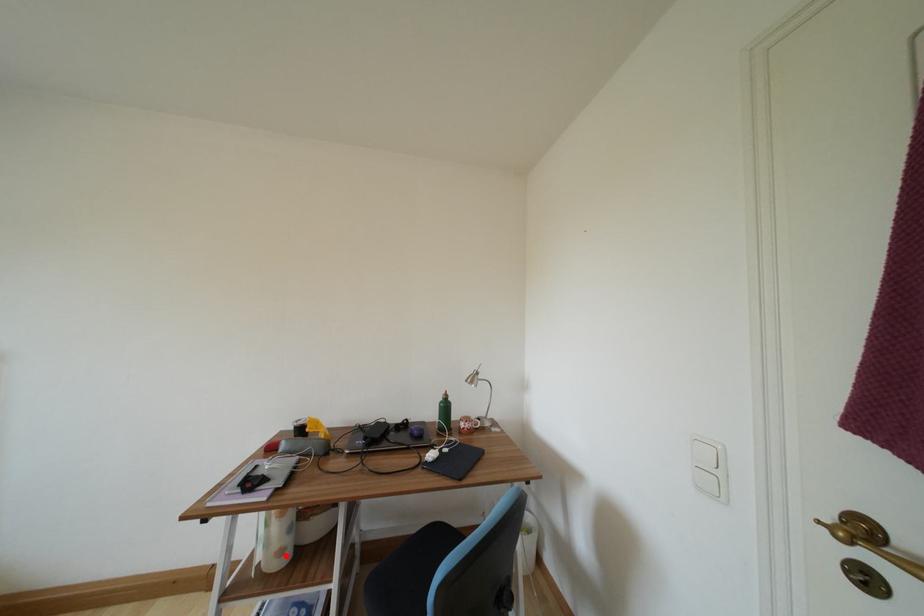
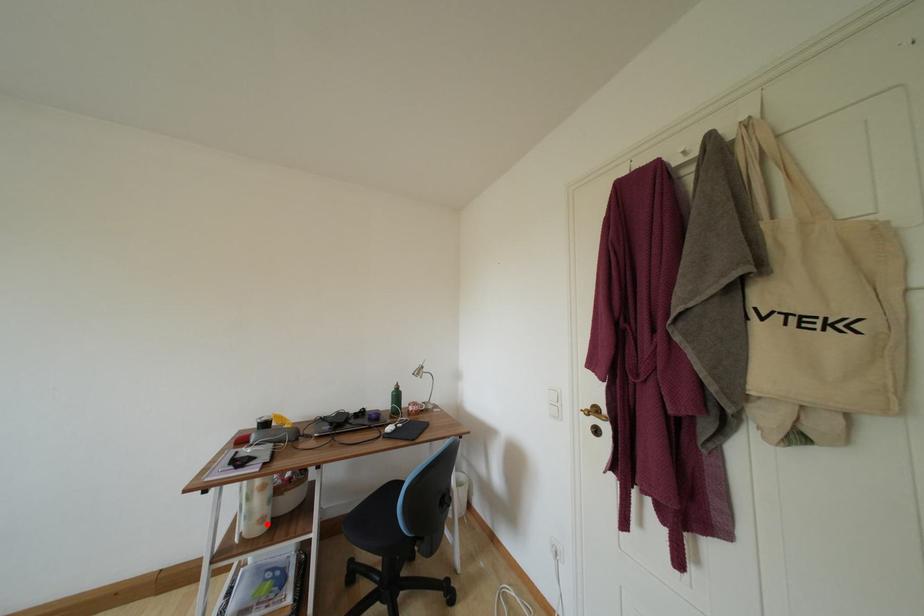
I am providing you with two images of the same scene from different viewpoints. A red point is marked on the first image and another point is marked on the second image. Is the red point in image1 aligned with the point shown in image2?

Yes